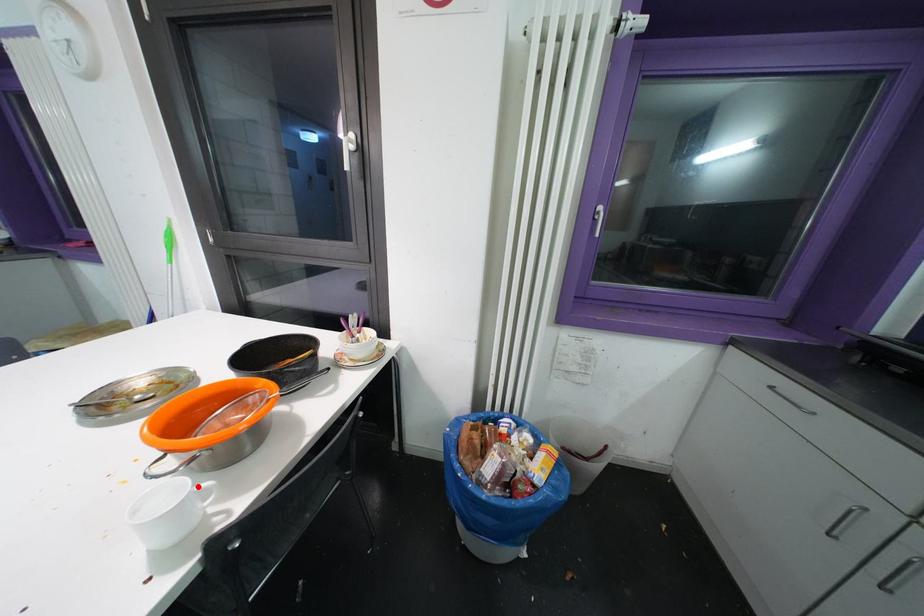
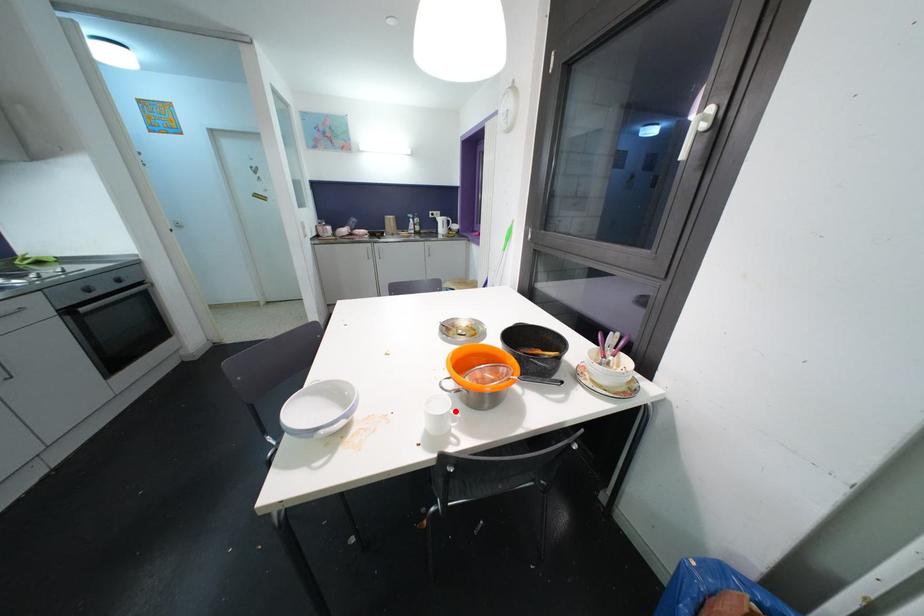
I am providing you with two images of the same scene from different viewpoints. A red point is marked on the first image and another point is marked on the second image. Do the highlighted points in image1 and image2 indicate the same real-world spot?

Yes